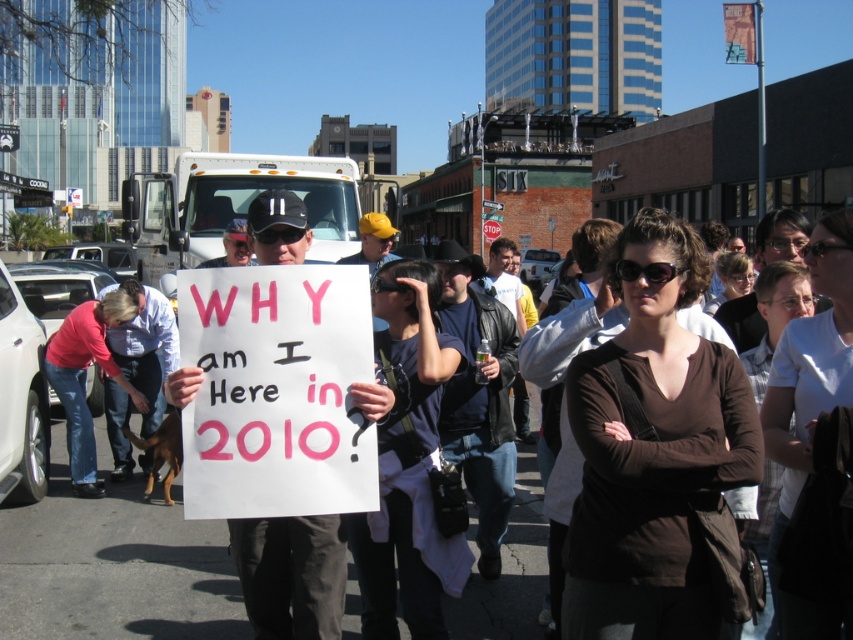
Question: Is the position of brown fabric shirt at center less distant than that of white cotton shirt at center?

Choices:
 (A) yes
 (B) no

Answer: (A)

Question: Can you confirm if brown fabric shirt at center is smaller than white cotton shirt at center?

Choices:
 (A) no
 (B) yes

Answer: (B)

Question: Which point is closer to the camera?

Choices:
 (A) pyautogui.click(x=776, y=522)
 (B) pyautogui.click(x=792, y=289)
 (C) pyautogui.click(x=399, y=259)

Answer: (A)

Question: Considering the real-world distances, which object is closest to the brown matte shirt at center?

Choices:
 (A) white cotton shirt at center
 (B) brown fabric shirt at center

Answer: (B)

Question: Which point is closer to the camera?

Choices:
 (A) (840, 284)
 (B) (757, 396)

Answer: (A)

Question: Is brown matte shirt at center wider than dark blue shirt at center?

Choices:
 (A) no
 (B) yes

Answer: (B)